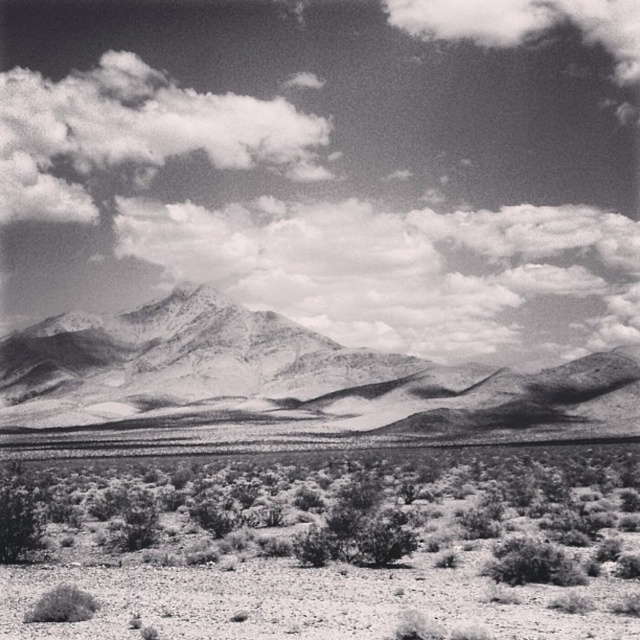
You are a photographer trying to capture the height comparison between the gravelly desert shrubs at lower center and the cloudy sky at upper left. Which one appears shorter in the photo?

The gravelly desert shrubs at lower center appear shorter than the cloudy sky at upper left in the photo.

You are analyzing a black and white desert landscape photograph. You need to locate the cloudy sky in the image. According to the coordinates provided, where exactly is the cloudy sky at upper center located?

The cloudy sky at upper center is located at the 2D coordinates point of [330,164].